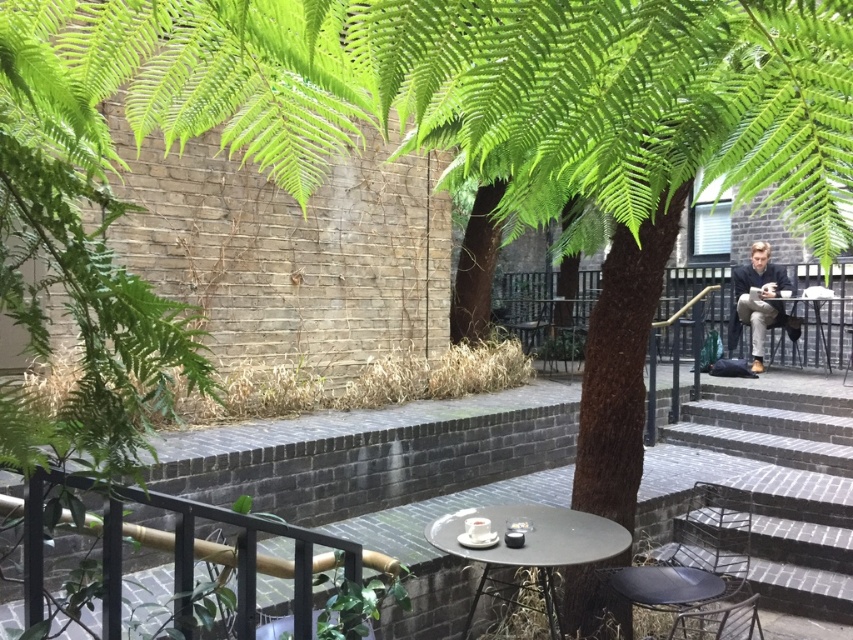
Can you confirm if dark blue jacket at right is positioned to the right of metallic gray chair at lower right?

Correct, you'll find dark blue jacket at right to the right of metallic gray chair at lower right.

Which of these two, dark blue jacket at right or metallic gray chair at lower right, stands shorter?

Standing shorter between the two is metallic gray chair at lower right.

The height and width of the screenshot is (640, 853). Identify the location of dark blue jacket at right. (758, 300).

Does dark gray stone stairs at center appear under metallic silver chair at center?

Yes, dark gray stone stairs at center is below metallic silver chair at center.

Is dark gray stone stairs at center closer to the viewer compared to metallic silver chair at center?

Yes, it is in front of metallic silver chair at center.

Between point (807, 426) and point (519, 317), which one is positioned in front?

Positioned in front is point (807, 426).

Where is `dark gray stone stairs at center`? This screenshot has width=853, height=640. dark gray stone stairs at center is located at coordinates (785, 490).

The image size is (853, 640). What do you see at coordinates (758, 300) in the screenshot?
I see `dark blue jacket at right` at bounding box center [758, 300].

Between point (770, 278) and point (517, 320), which one is positioned in front?

Point (770, 278) is more forward.

At what (x,y) coordinates should I click in order to perform the action: click on dark blue jacket at right. Please return your answer as a coordinate pair (x, y). The width and height of the screenshot is (853, 640). Looking at the image, I should click on (758, 300).